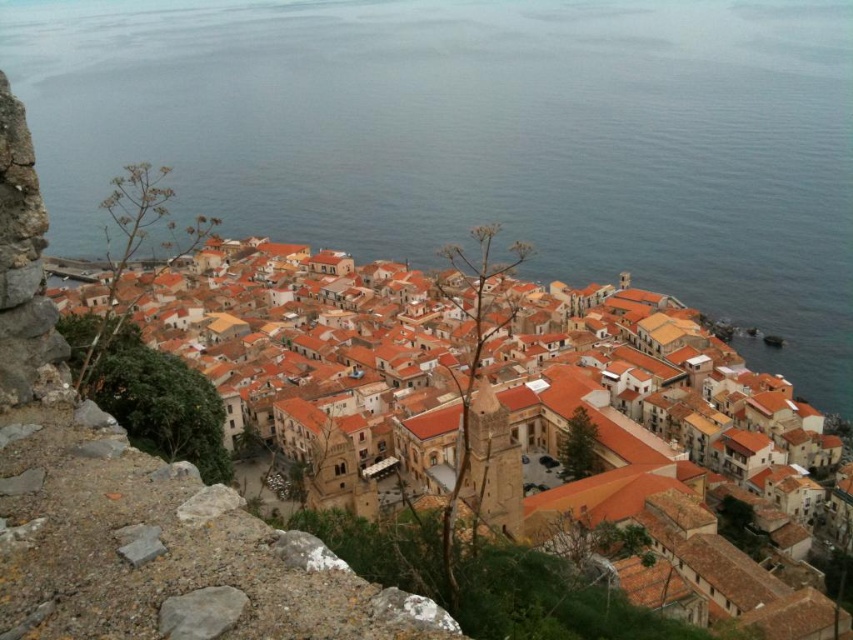
You are standing at the cliff overlooking the coastal town and see two points marked in the scene. Which point, point (849,212) or point (746,602), is closer to you?

Point (849,212) is further to the viewer than point (746,602), so the closer point to you is point (746,602).

You are standing on the cliff overlooking the town and notice the blue water at center and the orange clay buildings at center. From your vantage point, which one is positioned to the left?

The blue water at center is to the left of the orange clay buildings at center, so from your vantage point on the cliff, the blue water at center is positioned to the left.

You are a tourist standing on the rocky outcrop in the foreground of the coastal town. You see the blue water at center and the orange clay buildings at center. Which one appears bigger to you?

The blue water at center has a larger size compared to orange clay buildings at center, so the blue water at center appears bigger.